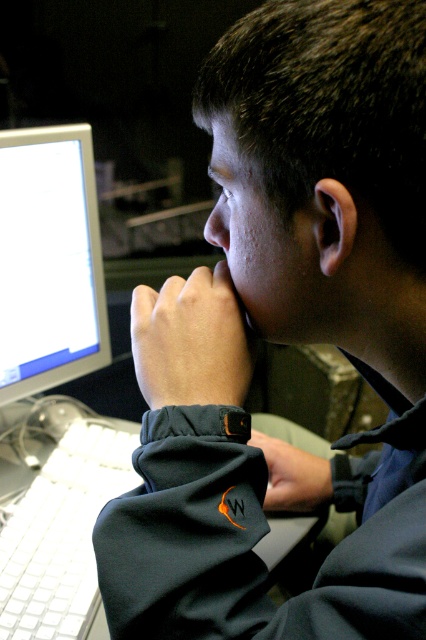
You are a graphic designer working on a project and need to place a new icon exactly at the center of the matte silver monitor at left. What are the coordinates where you should position the icon?

The coordinates for the center of the matte silver monitor at left are at point (48, 260).

You are designing a desk layout and need to place a new mouse next to the white plastic keyboard at lower left and the skinny white hand at center. Considering their sizes, where should the mouse be placed relative to the keyboard and hand?

The white plastic keyboard at lower left is bigger than the skinny white hand at center, so the mouse should be placed to the right of the keyboard to avoid overcrowding the space near the hand.